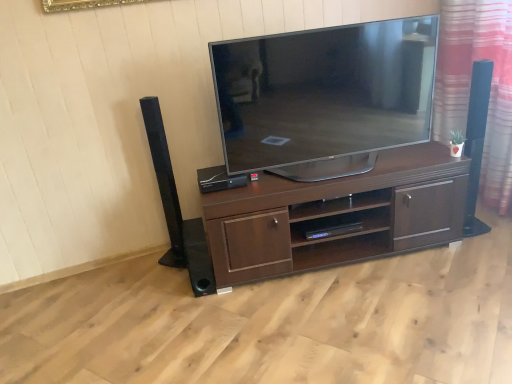
At what (x,y) coordinates should I click in order to perform the action: click on vacant region to the left of black matte speaker at lower center, acting as the 2th speaker starting from the left. Please return your answer as a coordinate pair (x, y). Looking at the image, I should click on (167, 287).